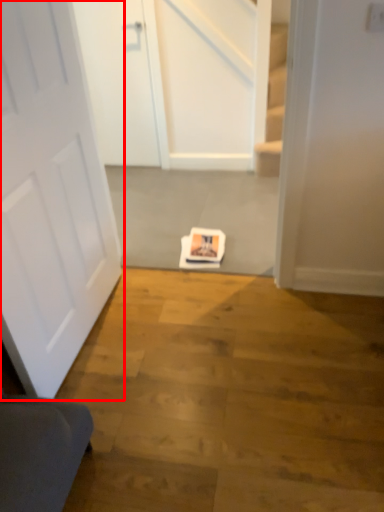
Question: From the image's perspective, what is the correct spatial relationship of door (annotated by the red box) in relation to door?

Choices:
 (A) above
 (B) below

Answer: (B)